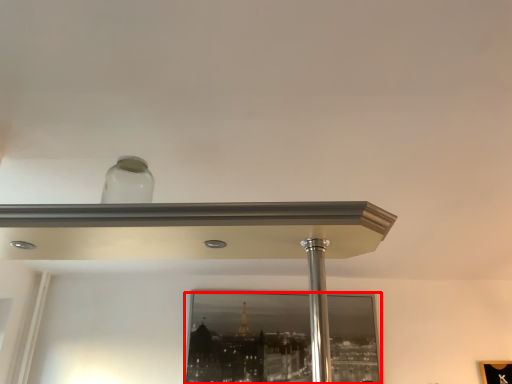
Question: Considering the relative positions of mirror (annotated by the red box) and pillar in the image provided, where is mirror (annotated by the red box) located with respect to the staircase?

Choices:
 (A) right
 (B) left

Answer: (B)